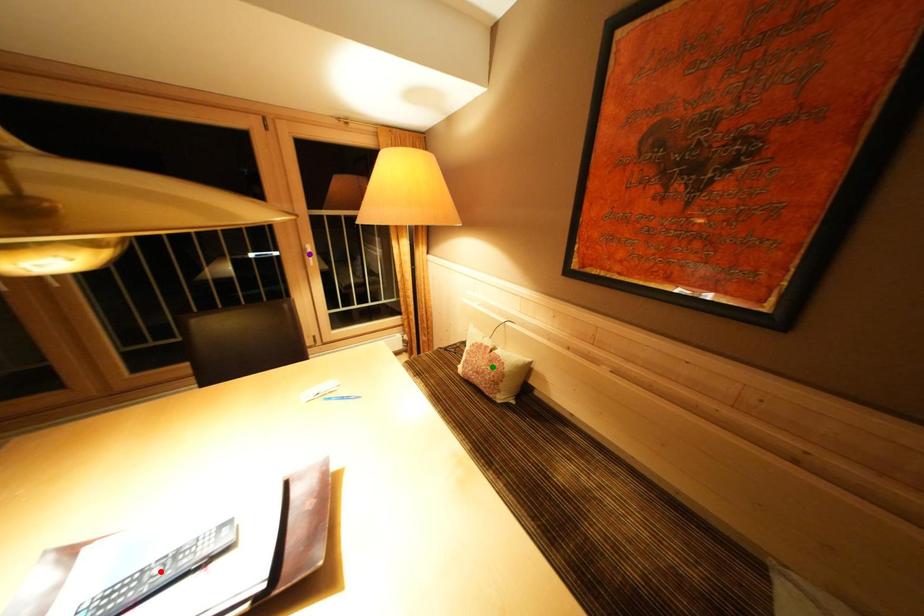
Order these from nearest to farthest:
1. green point
2. purple point
3. red point

red point, green point, purple point